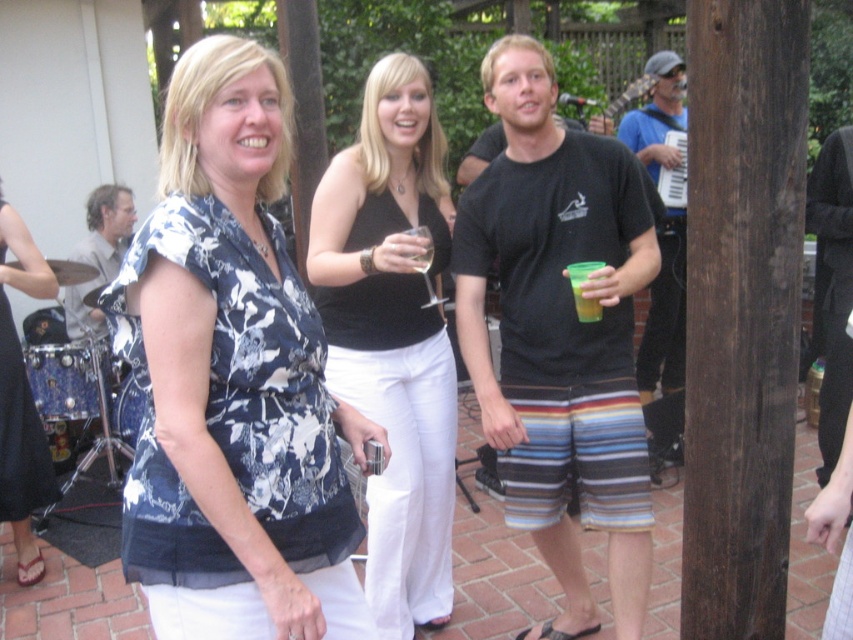
You are organizing a clothing display and need to place the floral fabric blouse at center and the gray fabric drum at left side by side. Which item requires more horizontal space for the display?

The floral fabric blouse at center requires more horizontal space because its width surpasses that of the gray fabric drum at left.

You are a photographer setting up for a group photo at the event. You need to position yourself between the matte floral blouse at center and the gray fabric drum at left to capture both in the frame. Given the distance between them, can you fit both subjects comfortably in a standard camera frame without moving either object?

The matte floral blouse at center and gray fabric drum at left are 4.10 feet apart. A standard camera frame can comfortably accommodate this distance, so yes, both subjects can be captured in the frame without needing to move either object.